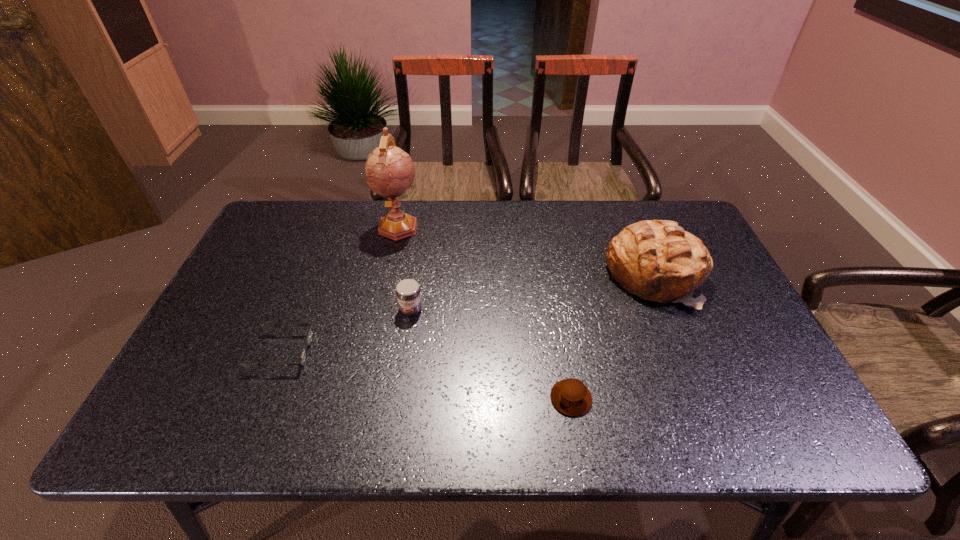
Identify the location of vacant space located on the front label of the jam. (403, 360).

I want to click on vacant space located 0.060m on the front of the fourth tallest object, so click(579, 444).

Find the location of a particular element. The image size is (960, 540). vacant space located 0.120m on the temples of the leftmost object is located at coordinates pos(361,352).

I want to click on globe that is positioned at the far edge, so click(390, 171).

Identify the location of bread present at the far edge. (657, 260).

Where is `object positioned at the near edge`? This screenshot has height=540, width=960. object positioned at the near edge is located at coordinates (570, 396).

The width and height of the screenshot is (960, 540). Identify the location of object positioned at the left edge. (309, 338).

This screenshot has width=960, height=540. In order to click on object situated at the right edge in this screenshot , I will do `click(657, 260)`.

Locate an element on the screen. This screenshot has width=960, height=540. object that is at the far right corner is located at coordinates (657, 260).

Find the location of a particular element. vacant space at the far edge of the desktop is located at coordinates tap(374, 234).